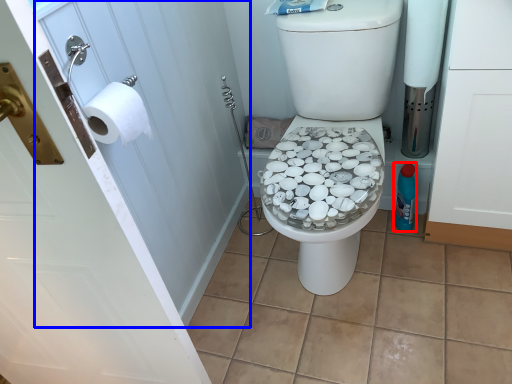
Question: Which point is closer to the camera, bottle (highlighted by a red box) or screen door (highlighted by a blue box)?

Choices:
 (A) bottle
 (B) screen door

Answer: (B)